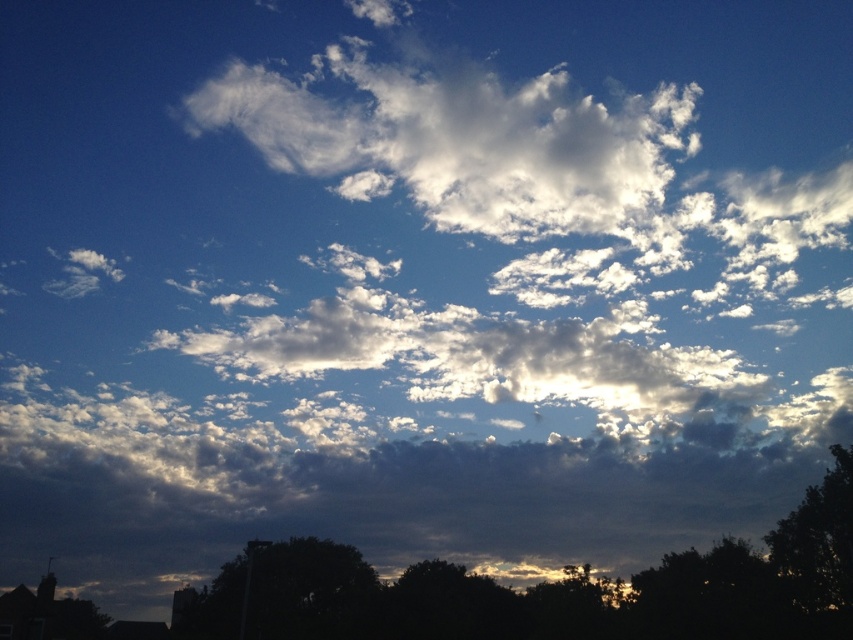
Based on the photo, you are standing at the center of the image and want to walk to both the dark green leafy tree at lower left and the dark green leafy tree at lower right. Which tree will you reach first?

The dark green leafy tree at lower left and dark green leafy tree at lower right are both equidistant from your current position since they are positioned symmetrically on either side. However, since you want to walk to both, you would need to decide which direction to go first. The distance between them is 7.41 meters, but your starting point is central, so both are equally near.

You are an astronomer observing the sky. You notice two points in the sky labeled as point 1 at coordinates point [244,582] and point 2 at coordinates point [839,602]. Which point is closer to the horizon?

Point 2 at coordinates point [839,602] is closer to the horizon because it has a higher y coordinate value, which places it lower in the image, closer to the horizon line.